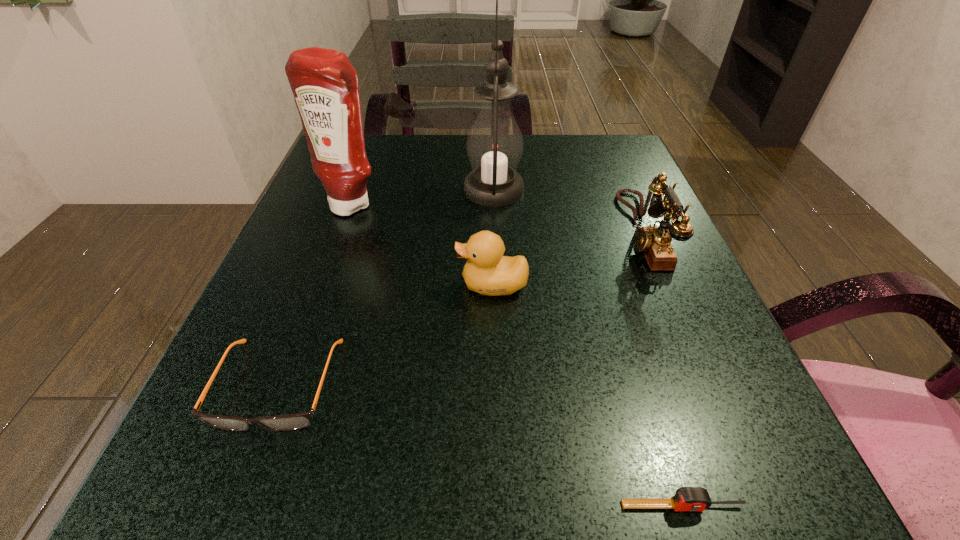
Image resolution: width=960 pixels, height=540 pixels. Identify the location of vacant region located on the front-facing side of the fourth shortest object. (563, 232).

Identify the location of free space located on the front-facing side of the fourth shortest object. The height and width of the screenshot is (540, 960). (419, 232).

Identify the location of blank space located 0.330m on the front-facing side of the fourth shortest object. tap(451, 232).

Where is `free location located facing forward on the third shortest object`? free location located facing forward on the third shortest object is located at coordinates (360, 285).

This screenshot has width=960, height=540. I want to click on free space located 0.100m facing forward on the third shortest object, so click(x=396, y=285).

The image size is (960, 540). What are the coordinates of `free region located facing forward on the third shortest object` in the screenshot? It's located at (402, 285).

This screenshot has height=540, width=960. What are the coordinates of `vacant region located 0.090m on the front-facing side of the second nearest object` in the screenshot? It's located at (229, 515).

The image size is (960, 540). What are the coordinates of `blank area located 0.100m on the back of the shortest object` in the screenshot? It's located at (655, 415).

Find the location of `object positioned at the far edge`. object positioned at the far edge is located at coordinates (494, 145).

Find the location of `object present at the near edge`. object present at the near edge is located at coordinates (686, 498).